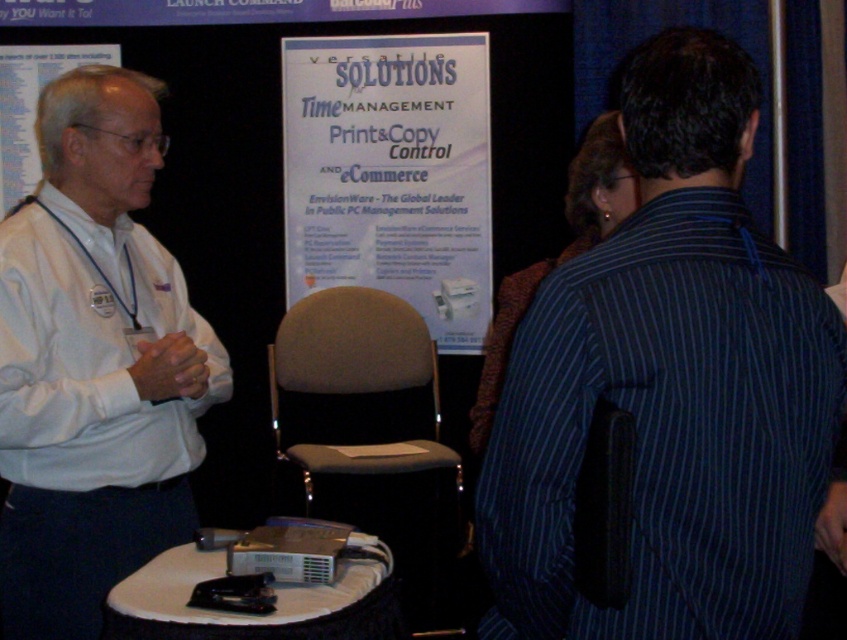
Question: Considering the relative positions of white paper at center and white paper at upper left in the image provided, where is white paper at center located with respect to white paper at upper left?

Choices:
 (A) right
 (B) left

Answer: (A)

Question: Does dark blue striped shirt at right have a smaller size compared to white shirt at left?

Choices:
 (A) yes
 (B) no

Answer: (A)

Question: Which point is farther to the camera?

Choices:
 (A) (432, 60)
 (B) (17, 120)

Answer: (B)

Question: Is dark blue striped shirt at right to the left of white paper at center from the viewer's perspective?

Choices:
 (A) yes
 (B) no

Answer: (B)

Question: Which point is closer to the camera?

Choices:
 (A) dark blue striped shirt at right
 (B) white paper at upper left
 (C) white paper at center
 (D) white shirt at left

Answer: (A)

Question: Which of the following is the farthest from the observer?

Choices:
 (A) (322, 157)
 (B) (65, 531)
 (C) (21, 163)
 (D) (696, 392)

Answer: (A)